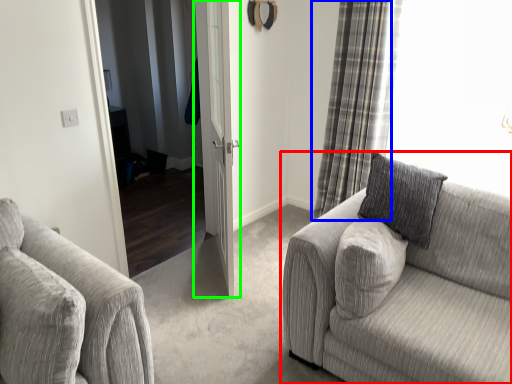
Question: Which is nearer to the studio couch (highlighted by a red box)? curtain (highlighted by a blue box) or door (highlighted by a green box).

Choices:
 (A) curtain
 (B) door

Answer: (B)